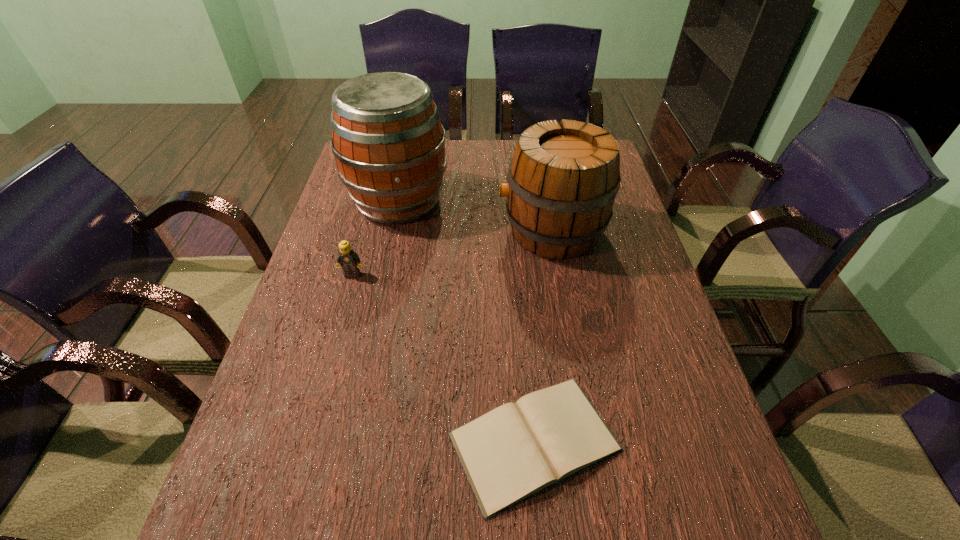
I want to click on blank region between the third tallest object and the left cider, so click(x=375, y=238).

Locate an element on the screen. This screenshot has height=540, width=960. object that is the closest to the Lego is located at coordinates (389, 145).

Where is `the second closest object to the second nearest object`? Image resolution: width=960 pixels, height=540 pixels. the second closest object to the second nearest object is located at coordinates (563, 178).

Where is `vacant space that satisfies the following two spatial constraints: 1. on the side of the right cider where the spigot is located; 2. in front of the third tallest object`? The height and width of the screenshot is (540, 960). vacant space that satisfies the following two spatial constraints: 1. on the side of the right cider where the spigot is located; 2. in front of the third tallest object is located at coordinates (560, 274).

The width and height of the screenshot is (960, 540). I want to click on free location that satisfies the following two spatial constraints: 1. in front of the Bible; 2. on the left side of the second shortest object, so click(x=305, y=441).